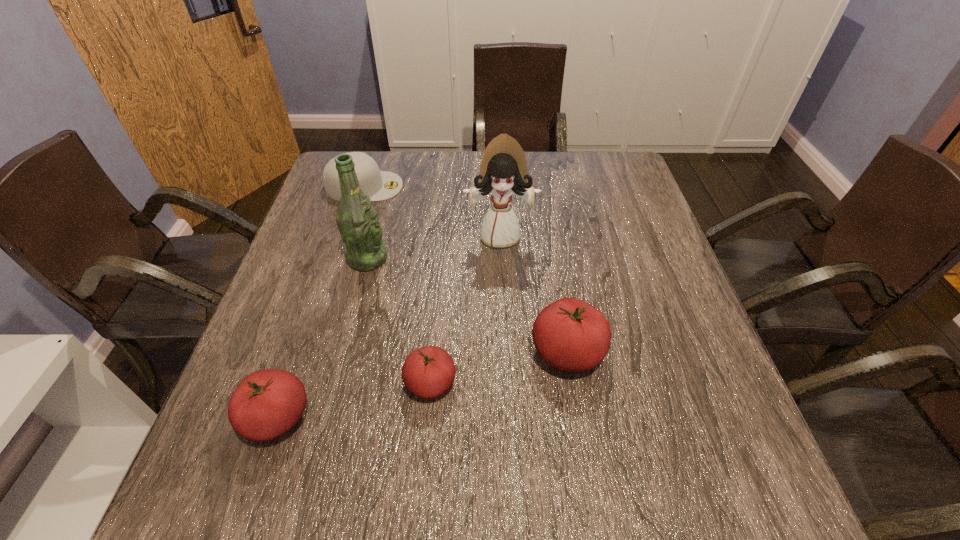
At what (x,y) coordinates should I click in order to perform the action: click on object located at the near left corner. Please return your answer as a coordinate pair (x, y). This screenshot has height=540, width=960. Looking at the image, I should click on [267, 403].

The height and width of the screenshot is (540, 960). Identify the location of free space at the far edge of the desktop. (540, 167).

You are a GUI agent. You are given a task and a screenshot of the screen. Output one action in this format:
    pyautogui.click(x=<x>, y=<y>)
    Task: Click on the vacant space at the near edge of the desktop
    This screenshot has width=960, height=540.
    Given the screenshot: What is the action you would take?
    pyautogui.click(x=555, y=430)

At what (x,y) coordinates should I click in order to perform the action: click on vacant point at the left edge. Please return your answer as a coordinate pair (x, y). This screenshot has height=540, width=960. Looking at the image, I should click on (290, 276).

Locate an element on the screen. free space at the right edge is located at coordinates (675, 366).

At what (x,y) coordinates should I click in order to perform the action: click on free location at the near left corner. Please return your answer as a coordinate pair (x, y). Looking at the image, I should click on (312, 424).

Find the location of `vacant space at the near right corner`. vacant space at the near right corner is located at coordinates (731, 431).

Locate an element on the screen. Image resolution: width=960 pixels, height=540 pixels. vacant area between the third tallest object and the doll is located at coordinates (534, 294).

I want to click on free point between the rightmost tomato and the second tomato from left to right, so click(499, 368).

At what (x,y) coordinates should I click in order to perform the action: click on empty space that is in between the fourth tallest object and the beer bottle. Please return your answer as a coordinate pair (x, y). The image size is (960, 540). Looking at the image, I should click on (323, 338).